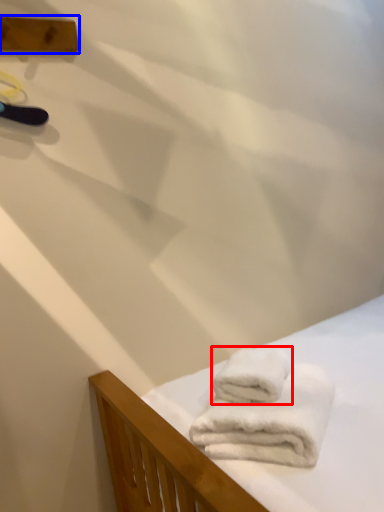
Question: Which of the following is the farthest to the observer, towel (highlighted by a red box) or plank (highlighted by a blue box)?

Choices:
 (A) towel
 (B) plank

Answer: (B)